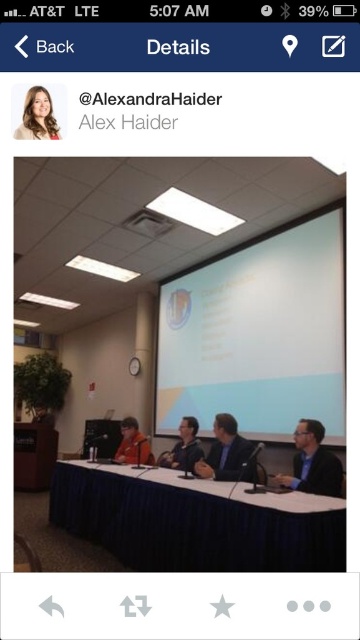
Question: Is light brown hair at upper left closer to the viewer compared to matte black suit at center?

Choices:
 (A) no
 (B) yes

Answer: (B)

Question: Does white glossy projection screen at upper center appear over blue fabric table at center?

Choices:
 (A) yes
 (B) no

Answer: (A)

Question: Is light brown hair at upper left positioned in front of matte black suit at center?

Choices:
 (A) yes
 (B) no

Answer: (A)

Question: Which point is closer to the camera?

Choices:
 (A) (60, 520)
 (B) (190, 458)

Answer: (B)

Question: Based on their relative distances, which object is farther from the matte black suit at center?

Choices:
 (A) white glossy projection screen at upper center
 (B) dark blue suit at center
 (C) light brown hair at upper left

Answer: (C)

Question: Among these points, which one is farthest from the camera?

Choices:
 (A) (141, 448)
 (B) (297, 445)
 (C) (222, 273)
 (D) (293, 508)

Answer: (C)